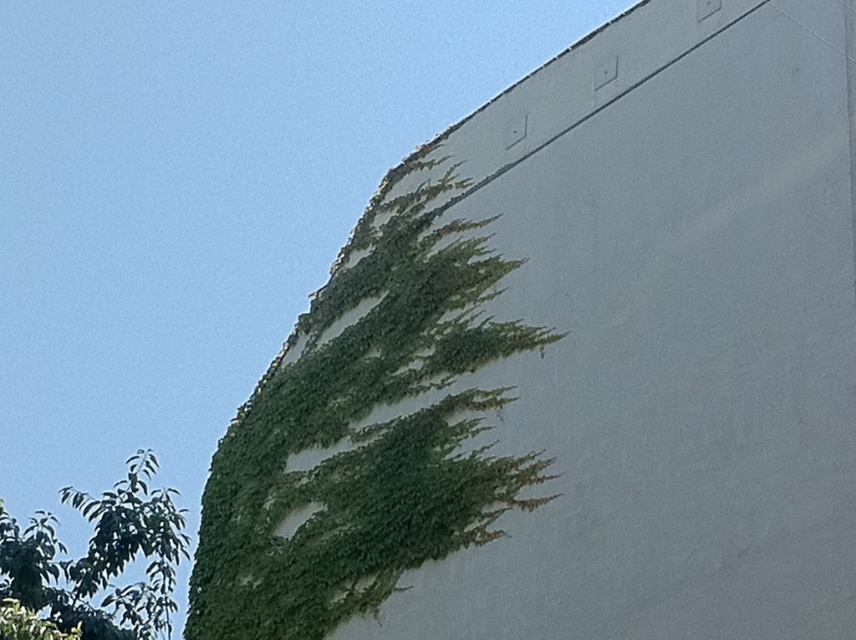
Question: Where is green leafy ivy at upper left located in relation to green leafy tree at lower left in the image?

Choices:
 (A) right
 (B) left

Answer: (A)

Question: Can you confirm if green leafy ivy at upper left is smaller than green leafy tree at lower left?

Choices:
 (A) no
 (B) yes

Answer: (B)

Question: Which point is farther to the camera?

Choices:
 (A) (51, 518)
 (B) (290, 378)

Answer: (A)

Question: Which object is farther from the camera taking this photo?

Choices:
 (A) green leafy ivy at upper left
 (B) green leafy tree at lower left

Answer: (A)

Question: Among these points, which one is nearest to the camera?

Choices:
 (A) click(146, 557)
 (B) click(434, 454)

Answer: (B)

Question: Does green leafy ivy at upper left appear on the right side of green leafy tree at lower left?

Choices:
 (A) no
 (B) yes

Answer: (B)